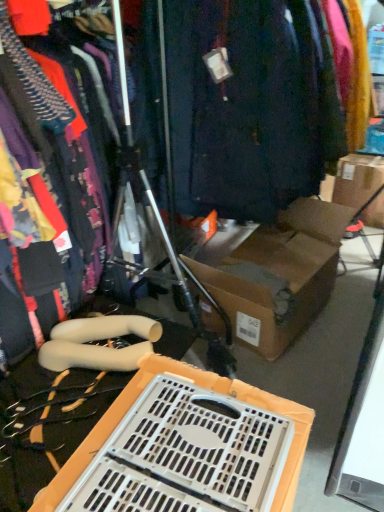
Where is `brown cardboard box at upper right`? brown cardboard box at upper right is located at coordinates (355, 180).

Looking at this image, measure the distance between point (92, 440) and camera.

Point (92, 440) and camera are 94.10 centimeters apart.

Find the location of `brown cardboard box at upper right`. brown cardboard box at upper right is located at coordinates (355, 180).

The width and height of the screenshot is (384, 512). I want to click on clothing lying below the dark blue fabric at center (from the image's perspective), so click(49, 119).

In terms of height, does dark blue fabric at center look taller or shorter compared to matte black dress at left?

Clearly, dark blue fabric at center is taller compared to matte black dress at left.

From a real-world perspective, does dark blue fabric at center stand above matte black dress at left?

Actually, dark blue fabric at center is physically below matte black dress at left in the real world.

Is dark blue fabric at center wider or thinner than matte black dress at left?

In the image, dark blue fabric at center appears to be wider than matte black dress at left.

Is point (76, 134) more distant than point (370, 187)?

No.

From the image's perspective, relative to brown cardboard box at upper right, is matte black dress at left above or below?

matte black dress at left is below brown cardboard box at upper right.

Is matte black dress at left oriented away from brown cardboard box at upper right?

No, matte black dress at left is not facing the opposite direction of brown cardboard box at upper right.

Relative to brown cardboard box at upper right, is matte black dress at left in front or behind?

In the image, matte black dress at left appears in front of brown cardboard box at upper right.

Which object is more forward, brown cardboard box at upper right or white plastic crate at lower center?

white plastic crate at lower center is in front.

Consider the image. Considering the relative sizes of brown cardboard box at upper right and white plastic crate at lower center in the image provided, is brown cardboard box at upper right bigger than white plastic crate at lower center?

Yes.

From the image's perspective, which one is positioned higher, brown cardboard box at upper right or white plastic crate at lower center?

From the image's view, brown cardboard box at upper right is above.

Can you confirm if brown cardboard box at upper right is wider than white plastic crate at lower center?

Indeed, brown cardboard box at upper right has a greater width compared to white plastic crate at lower center.

Considering the relative sizes of matte black dress at left and white plastic crate at lower center in the image provided, is matte black dress at left taller than white plastic crate at lower center?

Yes, matte black dress at left is taller than white plastic crate at lower center.

In terms of width, does matte black dress at left look wider or thinner when compared to white plastic crate at lower center?

Clearly, matte black dress at left has more width compared to white plastic crate at lower center.

Between matte black dress at left and white plastic crate at lower center, which one is positioned behind?

white plastic crate at lower center is behind.

Between matte black dress at left and white plastic crate at lower center, which one appears on the left side from the viewer's perspective?

Positioned to the left is matte black dress at left.

Can you confirm if brown cardboard box at upper right is shorter than dark blue fabric at center?

Yes, brown cardboard box at upper right is shorter than dark blue fabric at center.

This screenshot has width=384, height=512. I want to click on cardboard box below the dark blue fabric at center (from the image's perspective), so click(355, 180).

Looking at this image, is brown cardboard box at upper right inside or outside of dark blue fabric at center?

brown cardboard box at upper right is not enclosed by dark blue fabric at center.

From a real-world perspective, does brown cardboard box at upper right stand above dark blue fabric at center?

Actually, brown cardboard box at upper right is physically below dark blue fabric at center in the real world.

Which is further, (136, 436) or (50, 289)?

The point (50, 289) is farther.

Does white plastic crate at lower center contain matte black dress at left?

Actually, matte black dress at left is outside white plastic crate at lower center.

Could you tell me if white plastic crate at lower center is turned towards matte black dress at left?

No, white plastic crate at lower center is not aimed at matte black dress at left.

Is brown cardboard box at upper right facing away from matte black dress at left?

No, matte black dress at left is not at the back of brown cardboard box at upper right.

Does brown cardboard box at upper right have a greater height compared to matte black dress at left?

No, brown cardboard box at upper right is not taller than matte black dress at left.

Looking at this image, which of these two, brown cardboard box at upper right or matte black dress at left, is thinner?

matte black dress at left.

Where is `closet above the matte black dress at left (from the image's perspective)`? closet above the matte black dress at left (from the image's perspective) is located at coordinates (261, 111).

Locate an element on the screen. The width and height of the screenshot is (384, 512). cardboard box located on the right of matte black dress at left is located at coordinates (355, 180).

From the image, which object appears to be farther from brown cardboard box at upper right, matte black dress at left or dark blue fabric at center?

matte black dress at left is positioned further to the anchor brown cardboard box at upper right.

Estimate the real-world distances between objects in this image. Which object is closer to matte black dress at left, brown cardboard box at upper right or dark blue fabric at center?

dark blue fabric at center.

When comparing their distances from matte black dress at left, does dark blue fabric at center or brown cardboard box at upper right seem further?

brown cardboard box at upper right lies further to matte black dress at left than the other object.

Which object lies further to the anchor point dark blue fabric at center, white plastic crate at lower center or brown cardboard box at upper right?

brown cardboard box at upper right.

Looking at this image, considering their positions, is dark blue fabric at center positioned closer to white plastic crate at lower center than brown cardboard box at upper right?

dark blue fabric at center lies closer to white plastic crate at lower center than the other object.

Estimate the real-world distances between objects in this image. Which object is closer to dark blue fabric at center, matte black dress at left or brown cardboard box at upper right?

matte black dress at left lies closer to dark blue fabric at center than the other object.

From the image, which object appears to be nearer to matte black dress at left, white plastic crate at lower center or brown cardboard box at upper right?

white plastic crate at lower center lies closer to matte black dress at left than the other object.

Estimate the real-world distances between objects in this image. Which object is closer to dark blue fabric at center, white plastic crate at lower center or matte black dress at left?

Among the two, matte black dress at left is located nearer to dark blue fabric at center.

Find the location of a particular element. This screenshot has width=384, height=512. storage box between matte black dress at left and brown cardboard box at upper right in the front-back direction is located at coordinates (204, 391).

Locate an element on the screen. The image size is (384, 512). closet located between white plastic crate at lower center and brown cardboard box at upper right in the depth direction is located at coordinates [x=261, y=111].

The image size is (384, 512). What are the coordinates of `clothing that lies between dark blue fabric at center and white plastic crate at lower center from top to bottom` in the screenshot? It's located at (49, 119).

This screenshot has height=512, width=384. I want to click on closet between matte black dress at left and brown cardboard box at upper right along the z-axis, so click(261, 111).